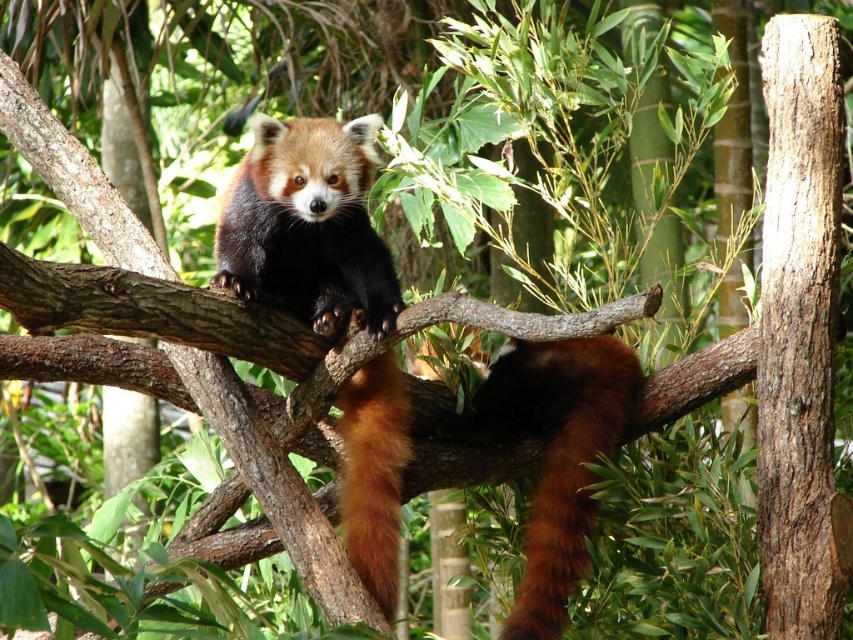
Question: Which point is closer to the camera taking this photo?

Choices:
 (A) (325, 168)
 (B) (375, 518)

Answer: (A)

Question: Can you confirm if fluffy brown-red fur at center is positioned above fluffy reddish-brown panda at center?

Choices:
 (A) yes
 (B) no

Answer: (B)

Question: Does fluffy brown-red fur at center have a greater width compared to fluffy reddish-brown panda at center?

Choices:
 (A) yes
 (B) no

Answer: (A)

Question: Can you confirm if fluffy brown-red fur at center is positioned to the left of fluffy reddish-brown panda at center?

Choices:
 (A) no
 (B) yes

Answer: (A)